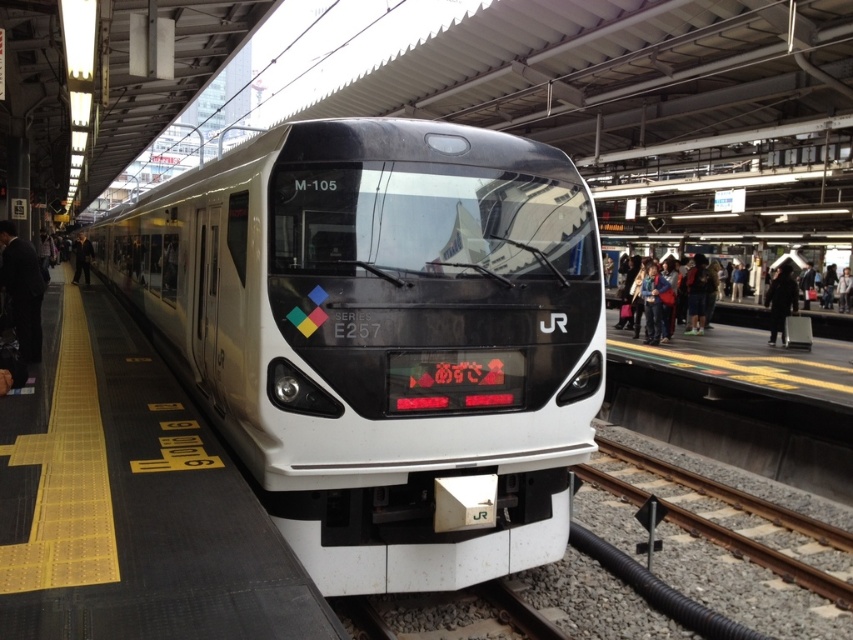
You are a passenger waiting at the train station platform. You notice a blue denim jacket at right and a black wool coat at center. Which clothing item appears to be smaller in size?

The blue denim jacket at right is smaller than the black wool coat at center.

You are a passenger at the train station and you want to place your blue denim jacket at right and black wool coat at center into a narrow overhead compartment that can only hold one layer of clothing. Which clothing item should you choose to fit into the compartment?

The blue denim jacket at right is thinner than the black wool coat at center, so the blue denim jacket at right should be chosen to fit into the narrow overhead compartment.